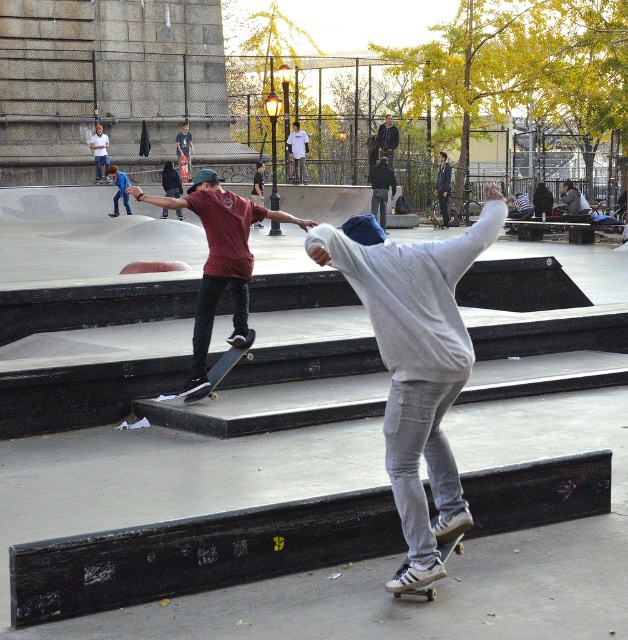
You are a photographer at the skatepark and want to capture both skateboarders in a single shot. You are positioned at point A, which is behind the skateboarder at point (300, 163). Can you see the skateboarder at point (379, 164) without any obstruction?

Yes, because point (379, 164) is in front of point (300, 163), so the skateboarder at point (379, 164) would be visible in front of the other skateboarder when viewed from point A.

You are a photographer standing at the center of the skatepark. You want to take a photo of the matte red shirt at center. Where should you aim your camera?

You should aim your camera at point (219, 259) to capture the matte red shirt at center.